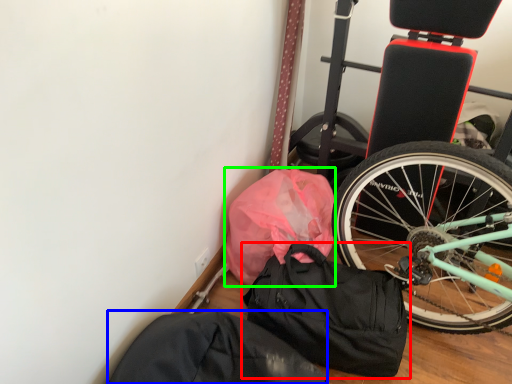
Question: Estimate the real-world distances between objects in this image. Which object is farther from luggage and bags (highlighted by a red box), sack (highlighted by a blue box) or material (highlighted by a green box)?

Choices:
 (A) sack
 (B) material

Answer: (A)